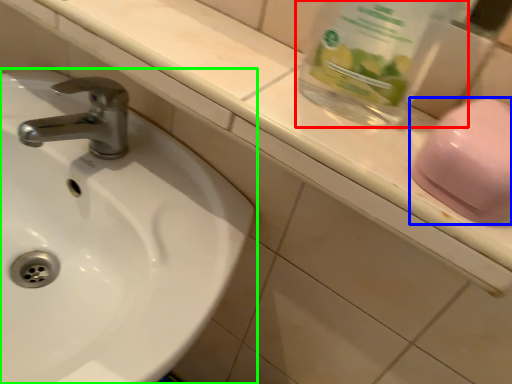
Question: Which object is the closest to the glass jar (highlighted by a red box)? Choose among these: soap (highlighted by a blue box) or sink (highlighted by a green box).

Choices:
 (A) soap
 (B) sink

Answer: (A)